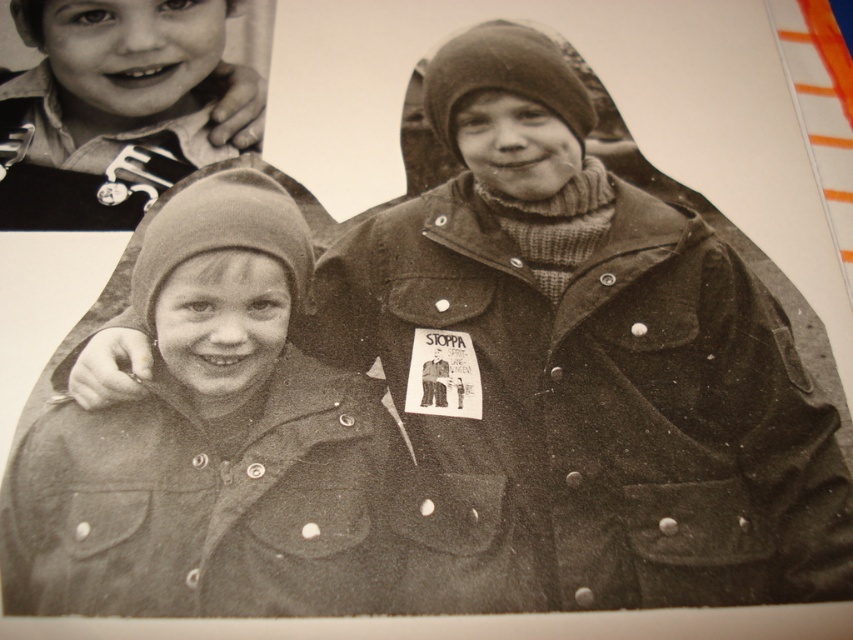
Who is positioned more to the right, coarse woolen hat at center or matte black shirt at upper left?

coarse woolen hat at center

Is point (141, 552) behind point (65, 116)?

No, it is not.

The height and width of the screenshot is (640, 853). Identify the location of coarse woolen hat at center. (212, 444).